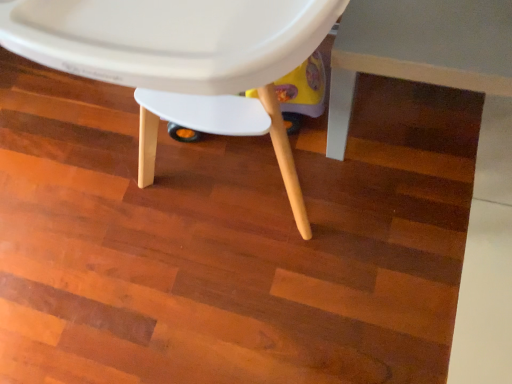
Where is `free region under white matte plastic chair at center (from a real-world perspective)`? The image size is (512, 384). free region under white matte plastic chair at center (from a real-world perspective) is located at coordinates (228, 167).